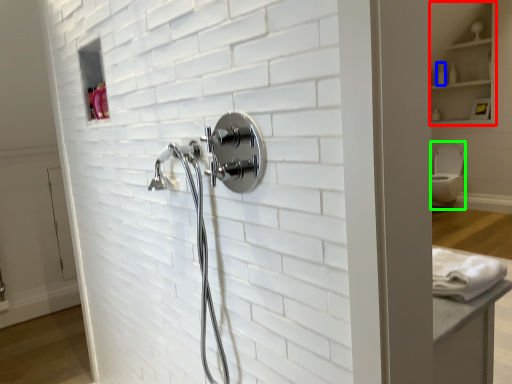
Question: Which object is positioned farthest from cabinet (highlighted by a red box)? Select from toiletry (highlighted by a blue box) and toilet bowl (highlighted by a green box).

Choices:
 (A) toiletry
 (B) toilet bowl

Answer: (B)